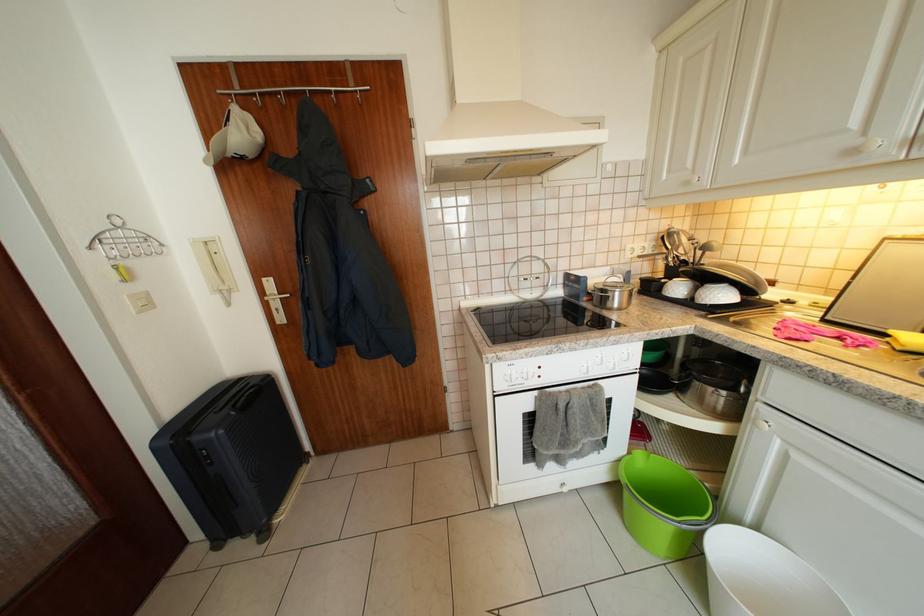
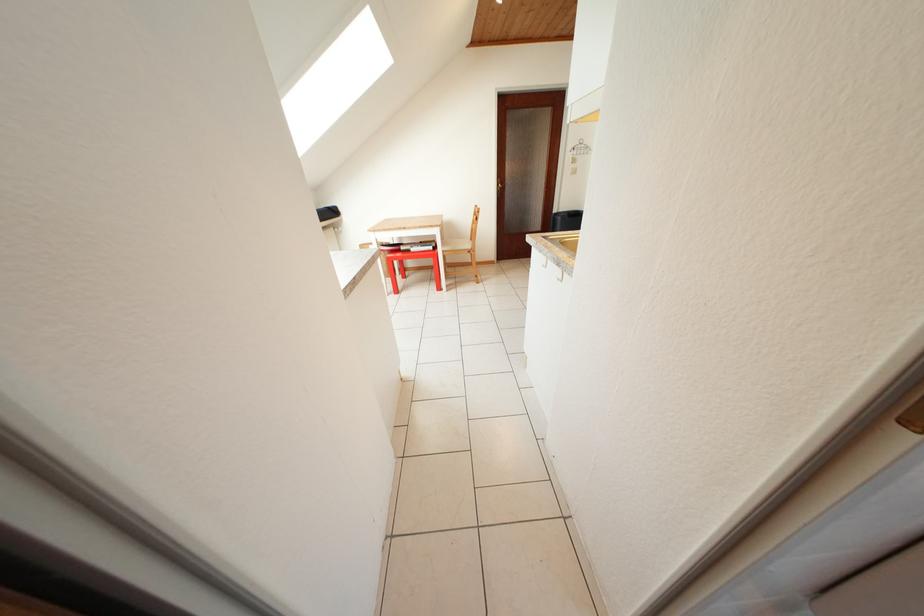
In the second image, find the point that corresponds to [84,243] in the first image.

(578, 153)